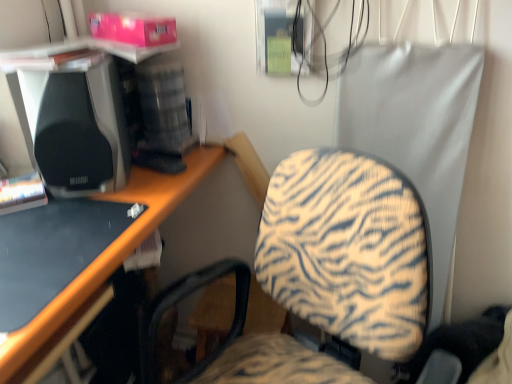
The image size is (512, 384). What are the coordinates of `black glossy desk at lower left` in the screenshot? It's located at [x=53, y=251].

Describe the element at coordinates (53, 251) in the screenshot. I see `black glossy desk at lower left` at that location.

In order to face black glossy desk at lower left, should I rotate leftwards or rightwards?

You should look left and rotate roughly 29.443 degrees.

The image size is (512, 384). Describe the element at coordinates (73, 139) in the screenshot. I see `black matte speaker at left` at that location.

In order to face black matte speaker at left, should I rotate leftwards or rightwards?

Turn left by 21.889 degrees to look at black matte speaker at left.

What is the approximate width of black matte speaker at left?

black matte speaker at left is 10.99 inches wide.

What are the coordinates of `black matte speaker at left` in the screenshot? It's located at (73, 139).

Find the location of `black glossy desk at lower left`. black glossy desk at lower left is located at coordinates (53, 251).

Considering the relative positions of black glossy desk at lower left and black matte speaker at left in the image provided, is black glossy desk at lower left to the left of black matte speaker at left from the viewer's perspective?

Indeed, black glossy desk at lower left is positioned on the left side of black matte speaker at left.

Considering their positions, is black glossy desk at lower left located in front of or behind black matte speaker at left?

Clearly, black glossy desk at lower left is in front of black matte speaker at left.

Is point (13, 283) more distant than point (54, 187)?

That is False.

From the image's perspective, would you say black glossy desk at lower left is shown under black matte speaker at left?

Yes, from the image's perspective, black glossy desk at lower left is below black matte speaker at left.

From a real-world perspective, which object stands above the other?

black matte speaker at left, from a real-world perspective.

Which of these two, black glossy desk at lower left or black matte speaker at left, is thinner?

black matte speaker at left is thinner.

Is black glossy desk at lower left shorter than black matte speaker at left?

Correct, black glossy desk at lower left is not as tall as black matte speaker at left.

Based on the photo, does black glossy desk at lower left have a smaller size compared to black matte speaker at left?

Yes, black glossy desk at lower left is smaller than black matte speaker at left.

Is black glossy desk at lower left inside or outside of black matte speaker at left?

black glossy desk at lower left is spatially situated outside black matte speaker at left.

Does black glossy desk at lower left touch black matte speaker at left?

There is a gap between black glossy desk at lower left and black matte speaker at left.

Is black glossy desk at lower left facing away from black matte speaker at left?

black glossy desk at lower left does not have its back to black matte speaker at left.

Can you tell me how much black glossy desk at lower left and black matte speaker at left differ in facing direction?

The angle between the facing direction of black glossy desk at lower left and the facing direction of black matte speaker at left is 58 degrees.

Find the location of a particular element. Image resolution: width=512 pixels, height=384 pixels. speaker behind the black glossy desk at lower left is located at coordinates (73, 139).

Considering the positions of objects black matte speaker at left and black glossy desk at lower left in the image provided, who is more to the left, black matte speaker at left or black glossy desk at lower left?

black glossy desk at lower left.

Which object is closer to the camera taking this photo, black matte speaker at left or black glossy desk at lower left?

black glossy desk at lower left.

Considering the positions of points (62, 106) and (37, 294), is point (62, 106) farther from camera compared to point (37, 294)?

Yes, it is behind point (37, 294).

From the image's perspective, is black matte speaker at left under black glossy desk at lower left?

Incorrect, from the image's perspective, black matte speaker at left is higher than black glossy desk at lower left.

From a real-world perspective, is black matte speaker at left beneath black glossy desk at lower left?

No.

Between black matte speaker at left and black glossy desk at lower left, which one has smaller width?

Thinner between the two is black matte speaker at left.

Considering the relative sizes of black matte speaker at left and black glossy desk at lower left in the image provided, is black matte speaker at left shorter than black glossy desk at lower left?

Incorrect, the height of black matte speaker at left does not fall short of that of black glossy desk at lower left.

Which of these two, black matte speaker at left or black glossy desk at lower left, is smaller?

With smaller size is black glossy desk at lower left.

Would you say black matte speaker at left is outside black glossy desk at lower left?

That's correct, black matte speaker at left is outside of black glossy desk at lower left.

Are black matte speaker at left and black glossy desk at lower left far apart?

No.

Is black matte speaker at left facing away from black glossy desk at lower left?

No, black glossy desk at lower left is not at the back of black matte speaker at left.

How different are the orientations of black matte speaker at left and black glossy desk at lower left in degrees?

They differ by 58 degrees in their facing directions.

Locate an element on the screen. Image resolution: width=512 pixels, height=384 pixels. speaker that appears above the black glossy desk at lower left (from the image's perspective) is located at coordinates (73, 139).

This screenshot has height=384, width=512. What are the coordinates of `desktop directly beneath the black matte speaker at left (from a real-world perspective)` in the screenshot? It's located at (53, 251).

The width and height of the screenshot is (512, 384). What are the coordinates of `desktop below the black matte speaker at left (from the image's perspective)` in the screenshot? It's located at (53, 251).